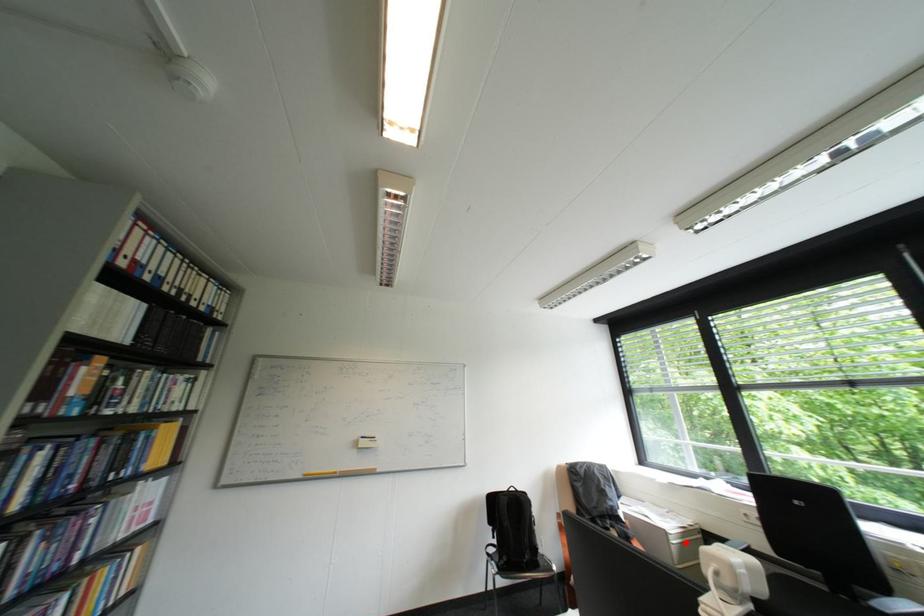
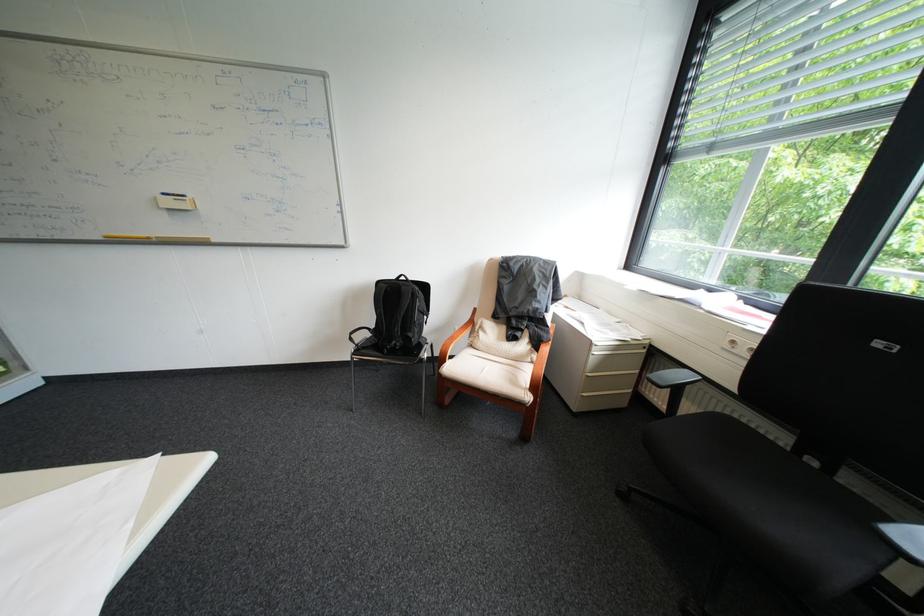
Question: I am providing you with two images of the same scene from different viewpoints. A red point is shown in image1. For the corresponding object point in image2, is it positioned nearer or farther from the camera?

Choices:
 (A) Nearer
 (B) Farther

Answer: (B)